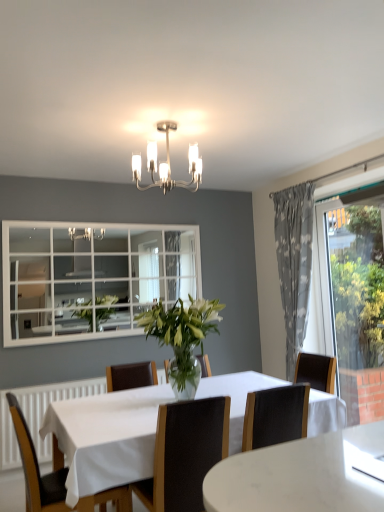
Locate an element on the screen. This screenshot has width=384, height=512. blank space above metallic chandelier at upper center (from a real-world perspective) is located at coordinates (x=179, y=120).